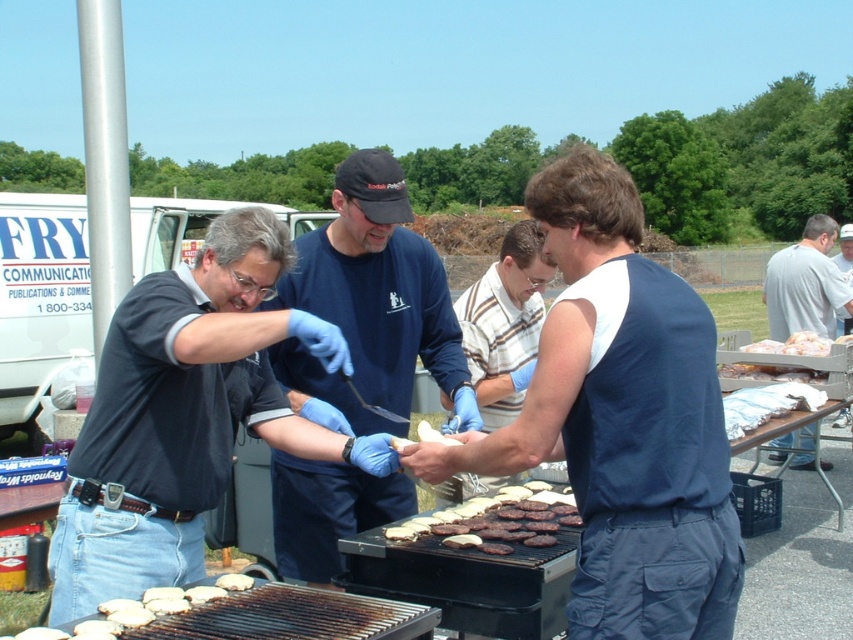
Question: Where is blue sleeveless shirt at center located in relation to gray cotton shirt at right in the image?

Choices:
 (A) above
 (B) below

Answer: (B)

Question: Which of the following is the closest to the observer?

Choices:
 (A) (537, 292)
 (B) (231, 579)

Answer: (B)

Question: Which object appears farthest from the camera in this image?

Choices:
 (A) gray cotton shirt at right
 (B) blue sleeveless shirt at center
 (C) dark blue shirt at center

Answer: (A)

Question: Is blue cotton shirt at center positioned at the back of white striped shirt at center?

Choices:
 (A) yes
 (B) no

Answer: (B)

Question: Estimate the real-world distances between objects in this image. Which object is farther from the white matte burger buns at center?

Choices:
 (A) blue cotton shirt at center
 (B) white striped shirt at center

Answer: (B)

Question: Can you confirm if blue sleeveless shirt at center is positioned above blue cotton shirt at center?

Choices:
 (A) no
 (B) yes

Answer: (A)